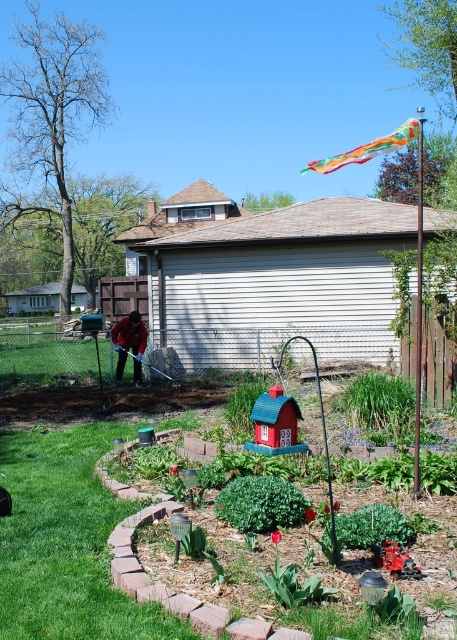
Between rainbow fabric kite at upper right and dark red sweater at center, which one appears on the left side from the viewer's perspective?

From the viewer's perspective, dark red sweater at center appears more on the left side.

What are the coordinates of `rainbow fabric kite at upper right` in the screenshot? It's located at (367, 148).

Is point (347, 163) positioned before point (126, 355)?

No, it is not.

You are a GUI agent. You are given a task and a screenshot of the screen. Output one action in this format:
    pyautogui.click(x=<x>, y=<y>)
    Task: Click on the rainbow fabric kite at upper right
    
    Given the screenshot: What is the action you would take?
    pyautogui.click(x=367, y=148)